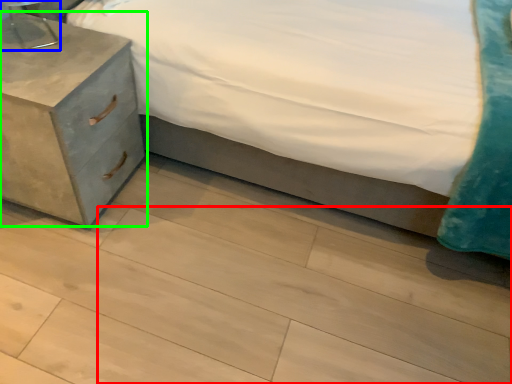
Question: Estimate the real-world distances between objects in this image. Which object is farther from tile (highlighted by a red box), table lamp (highlighted by a blue box) or nightstand (highlighted by a green box)?

Choices:
 (A) table lamp
 (B) nightstand

Answer: (A)